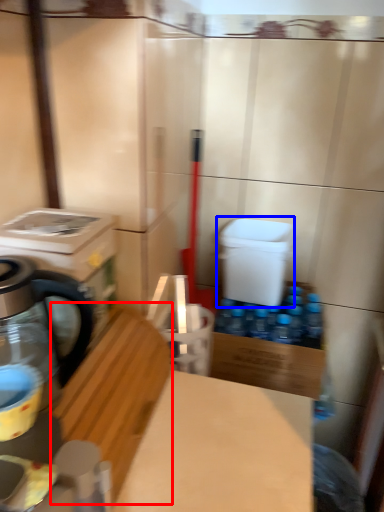
Question: Which object is closer to the camera taking this photo, wood (highlighted by a red box) or water cooler (highlighted by a blue box)?

Choices:
 (A) wood
 (B) water cooler

Answer: (A)